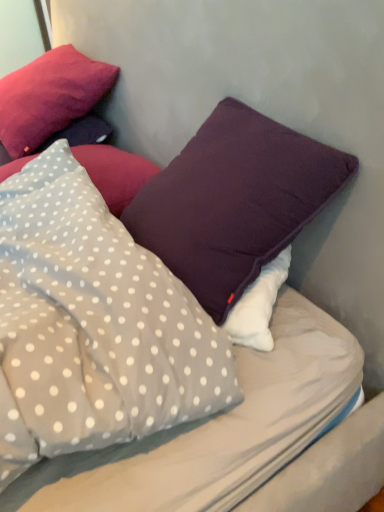
Question: Does gray polka dot pillow at center, the fourth pillow when ordered from top to bottom, appear on the left side of purple matte pillow at upper right, arranged as the 3th pillow when viewed from the top?

Choices:
 (A) yes
 (B) no

Answer: (A)

Question: Does gray polka dot pillow at center, the fourth pillow when ordered from top to bottom, have a larger size compared to purple matte pillow at upper right, which appears as the second pillow when ordered from the bottom?

Choices:
 (A) yes
 (B) no

Answer: (B)

Question: Does gray polka dot pillow at center, which is counted as the first pillow, starting from the bottom, turn towards purple matte pillow at upper right, which appears as the second pillow when ordered from the bottom?

Choices:
 (A) no
 (B) yes

Answer: (A)

Question: Is purple matte pillow at upper right, which appears as the second pillow when ordered from the bottom, completely or partially inside gray polka dot pillow at center, which is counted as the first pillow, starting from the bottom?

Choices:
 (A) no
 (B) yes

Answer: (A)

Question: Is the surface of gray polka dot pillow at center, which is counted as the first pillow, starting from the bottom, in direct contact with purple matte pillow at upper right, arranged as the 3th pillow when viewed from the top?

Choices:
 (A) no
 (B) yes

Answer: (A)

Question: Considering the relative sizes of gray polka dot pillow at center, the fourth pillow when ordered from top to bottom, and purple matte pillow at upper right, arranged as the 3th pillow when viewed from the top, in the image provided, is gray polka dot pillow at center, the fourth pillow when ordered from top to bottom, wider than purple matte pillow at upper right, arranged as the 3th pillow when viewed from the top,?

Choices:
 (A) yes
 (B) no

Answer: (B)

Question: Does gray polka dot pillow at center, which is counted as the first pillow, starting from the bottom, have a smaller size compared to white dotted fabric pillow at upper left, the third pillow in the bottom-to-top sequence?

Choices:
 (A) yes
 (B) no

Answer: (B)

Question: Does gray polka dot pillow at center, which is counted as the first pillow, starting from the bottom, have a greater height compared to white dotted fabric pillow at upper left, the second pillow when ordered from top to bottom?

Choices:
 (A) yes
 (B) no

Answer: (A)

Question: Does gray polka dot pillow at center, which is counted as the first pillow, starting from the bottom, lie in front of white dotted fabric pillow at upper left, the third pillow in the bottom-to-top sequence?

Choices:
 (A) no
 (B) yes

Answer: (B)

Question: Considering the relative positions of gray polka dot pillow at center, the fourth pillow when ordered from top to bottom, and white dotted fabric pillow at upper left, the third pillow in the bottom-to-top sequence, in the image provided, is gray polka dot pillow at center, the fourth pillow when ordered from top to bottom, to the right of white dotted fabric pillow at upper left, the third pillow in the bottom-to-top sequence, from the viewer's perspective?

Choices:
 (A) no
 (B) yes

Answer: (B)

Question: Is the position of gray polka dot pillow at center, which is counted as the first pillow, starting from the bottom, more distant than that of white dotted fabric pillow at upper left, the second pillow when ordered from top to bottom?

Choices:
 (A) yes
 (B) no

Answer: (B)

Question: From a real-world perspective, is gray polka dot pillow at center, which is counted as the first pillow, starting from the bottom, over white dotted fabric pillow at upper left, the third pillow in the bottom-to-top sequence?

Choices:
 (A) no
 (B) yes

Answer: (B)

Question: Would you say purple matte pillow at upper right, which appears as the second pillow when ordered from the bottom, is part of matte purple pillow at upper left, positioned as the 4th pillow in bottom-to-top order,'s contents?

Choices:
 (A) yes
 (B) no

Answer: (B)